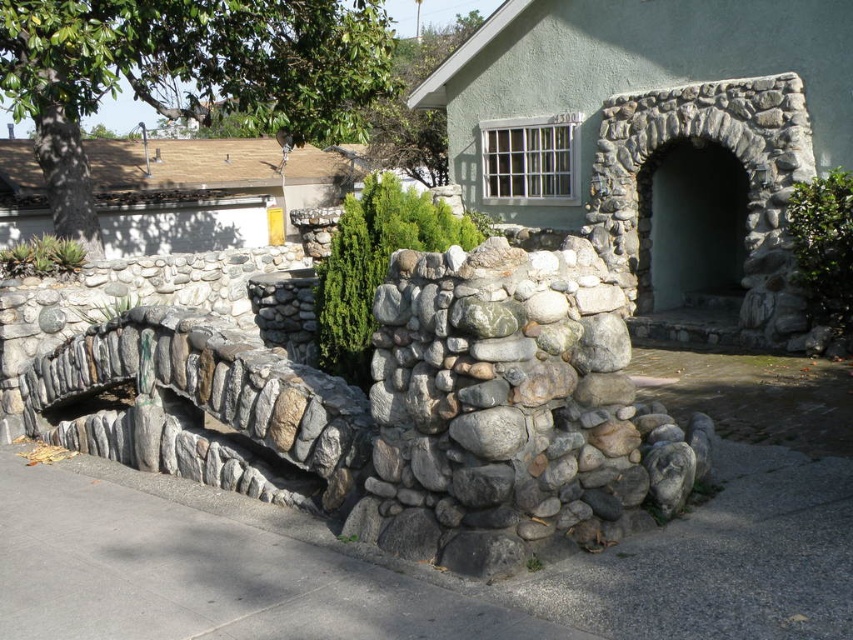
Question: Does gray concrete pavement at center have a smaller size compared to gray concrete pavement at lower left?

Choices:
 (A) no
 (B) yes

Answer: (B)

Question: Can you confirm if gray concrete pavement at center is smaller than gray concrete pavement at lower left?

Choices:
 (A) no
 (B) yes

Answer: (B)

Question: Which point is closer to the camera?

Choices:
 (A) gray concrete pavement at lower left
 (B) gray concrete pavement at center

Answer: (A)

Question: Which object is farther from the camera taking this photo?

Choices:
 (A) gray concrete pavement at lower left
 (B) gray concrete pavement at center

Answer: (B)

Question: Does gray concrete pavement at center appear on the left side of gray concrete pavement at lower left?

Choices:
 (A) no
 (B) yes

Answer: (A)